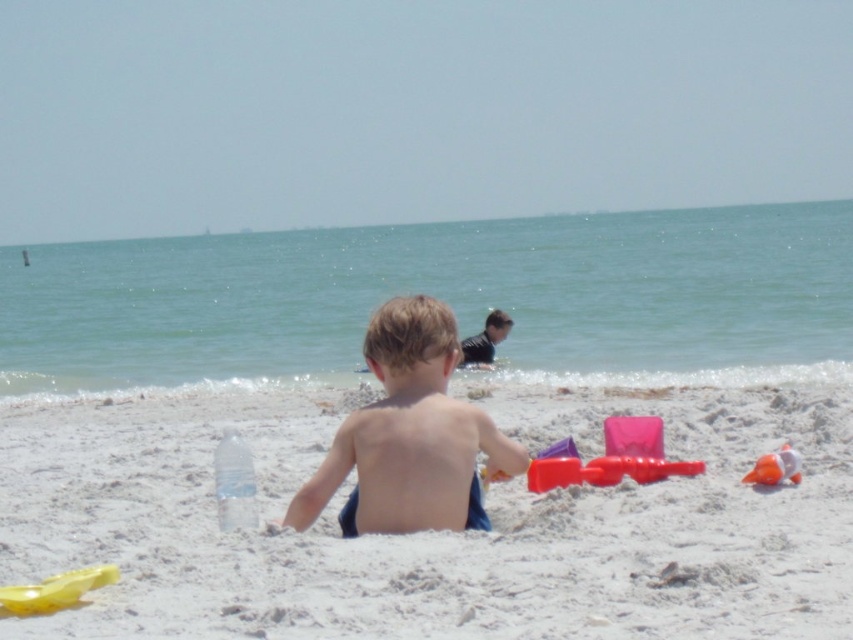
Question: Which of the following is the closest to the observer?

Choices:
 (A) (445, 337)
 (B) (24, 608)

Answer: (B)

Question: From the image, what is the correct spatial relationship of smooth skin boy at center in relation to rubber yellow shovel at lower left?

Choices:
 (A) below
 (B) above

Answer: (B)

Question: Considering the real-world distances, which object is farthest from the smooth skin boy at center?

Choices:
 (A) rubber sand toys at lower center
 (B) dark blue wetsuit at upper center
 (C) smooth sand at center

Answer: (C)

Question: Which object is farther from the camera taking this photo?

Choices:
 (A) smooth skin boy at center
 (B) orange rubber ball at lower right
 (C) smooth sand at center

Answer: (B)

Question: From the image, what is the correct spatial relationship of rubber yellow shovel at lower left in relation to dark blue wetsuit at upper center?

Choices:
 (A) above
 (B) below

Answer: (B)

Question: Is smooth sand at center to the right of rubber yellow shovel at lower left from the viewer's perspective?

Choices:
 (A) yes
 (B) no

Answer: (A)